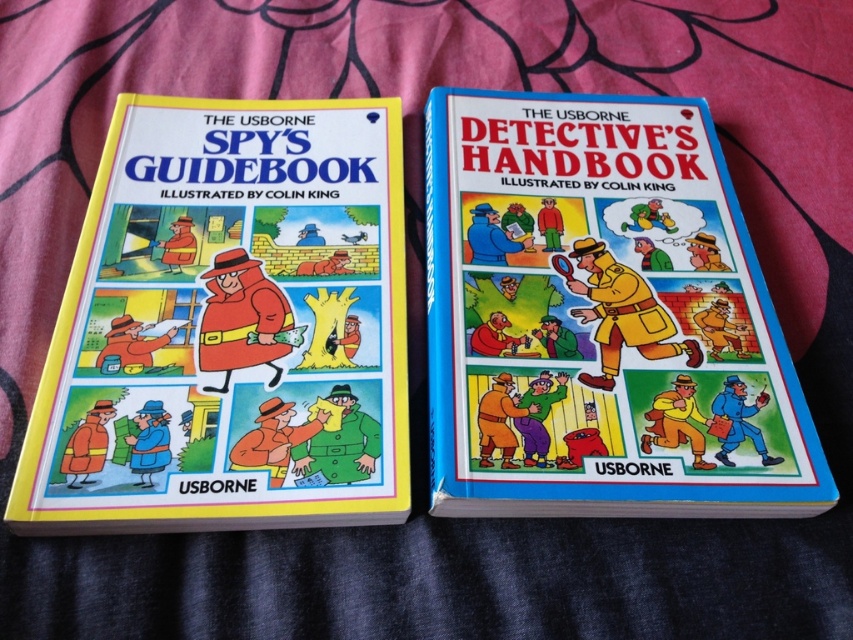
You are organizing a bookshelf and need to place the matte yellow book at left and the blue hardcover book at center. According to the image, which book should be placed lower on the shelf?

The matte yellow book at left should be placed lower because it is positioned below the blue hardcover book at center in the image.

You are organizing a bookshelf and need to place the matte yellow book at left and the blue hardcover book at center. The shelf you have is 12 inches wide. Can both books fit side by side on the shelf without overlapping?

The matte yellow book at left is 11.57 inches away from the blue hardcover book at center. Since the total distance between them is less than 12 inches, both books can fit side by side on the 12 inch wide shelf without overlapping.

You are organizing a childrens bookshelf and need to place the matte yellow book at left and the blue hardcover book at center. Given that the shelf has limited space, which book should you place first to maximize the number of books that can fit?

The matte yellow book at left has a smaller size compared to the blue hardcover book at center. To maximize the number of books that can fit on the shelf, place the larger blue hardcover book at center first, then the smaller matte yellow book at left. This arrangement optimizes space by placing larger items first to reduce gaps.